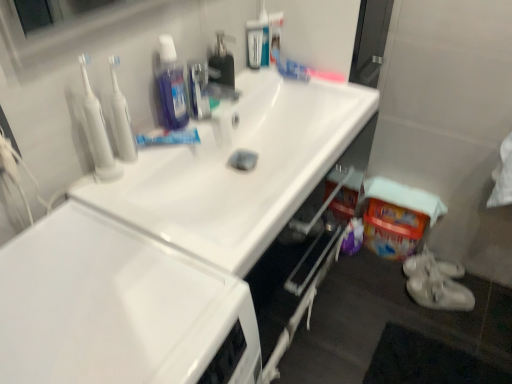
Question: Does white fabric towel at lower right have a smaller size compared to metallic silver faucet at upper center?

Choices:
 (A) yes
 (B) no

Answer: (B)

Question: Is white fabric towel at lower right closer to camera compared to metallic silver faucet at upper center?

Choices:
 (A) yes
 (B) no

Answer: (B)

Question: From the image's perspective, does white fabric towel at lower right appear lower than metallic silver faucet at upper center?

Choices:
 (A) yes
 (B) no

Answer: (A)

Question: From a real-world perspective, is white fabric towel at lower right located higher than metallic silver faucet at upper center?

Choices:
 (A) no
 (B) yes

Answer: (A)

Question: Considering the relative sizes of white fabric towel at lower right and metallic silver faucet at upper center in the image provided, is white fabric towel at lower right taller than metallic silver faucet at upper center?

Choices:
 (A) yes
 (B) no

Answer: (B)

Question: Which is correct: translucent plastic toothbrush at upper center is inside white plastic toothbrushes at upper left, the second cleanser from the left, or outside of it?

Choices:
 (A) inside
 (B) outside

Answer: (B)

Question: Is translucent plastic toothbrush at upper center taller or shorter than white plastic toothbrushes at upper left, the first cleanser from the right?

Choices:
 (A) tall
 (B) short

Answer: (B)

Question: From the image's perspective, is translucent plastic toothbrush at upper center located above or below white plastic toothbrushes at upper left, the first cleanser from the right?

Choices:
 (A) below
 (B) above

Answer: (B)

Question: In terms of size, does translucent plastic toothbrush at upper center appear bigger or smaller than white plastic toothbrushes at upper left, the first cleanser from the right?

Choices:
 (A) small
 (B) big

Answer: (B)

Question: From a real-world perspective, is white glossy sink at upper center physically located above or below translucent plastic toothbrush at upper center?

Choices:
 (A) above
 (B) below

Answer: (B)

Question: In terms of height, does white glossy sink at upper center look taller or shorter compared to translucent plastic toothbrush at upper center?

Choices:
 (A) tall
 (B) short

Answer: (B)

Question: From the image's perspective, is white glossy sink at upper center above or below translucent plastic toothbrush at upper center?

Choices:
 (A) above
 (B) below

Answer: (B)

Question: Would you say white glossy sink at upper center is inside or outside translucent plastic toothbrush at upper center?

Choices:
 (A) inside
 (B) outside

Answer: (B)

Question: In terms of height, does clear plastic bottle at upper center, the third cleaning products when ordered from left to right, look taller or shorter compared to white fabric towel at lower right?

Choices:
 (A) short
 (B) tall

Answer: (B)

Question: From the image's perspective, relative to white fabric towel at lower right, is clear plastic bottle at upper center, positioned as the second cleaning products in right-to-left order, above or below?

Choices:
 (A) below
 (B) above

Answer: (B)